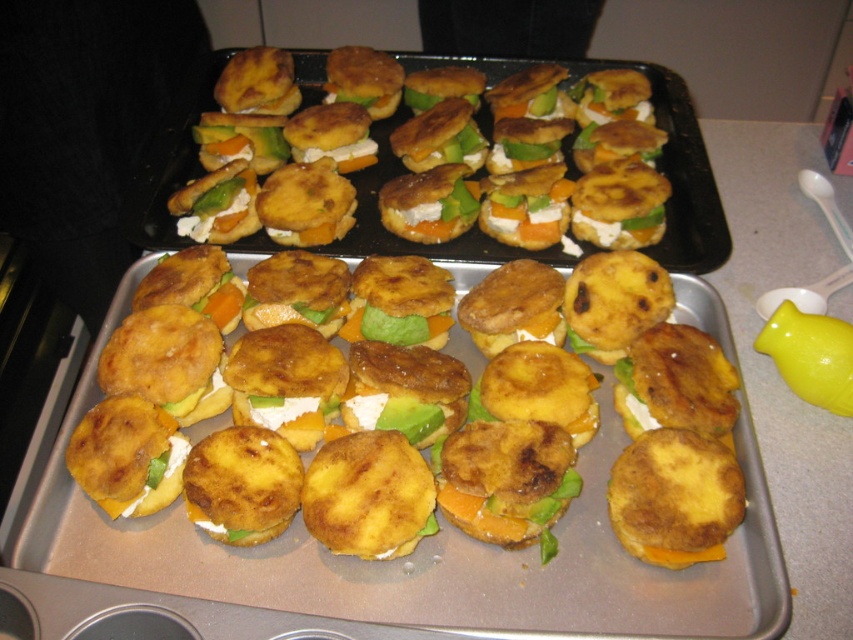
Is point (279, 522) positioned behind point (364, 200)?

No, it is not.

Locate an element on the screen. golden-brown fried patty at center is located at coordinates (430, 417).